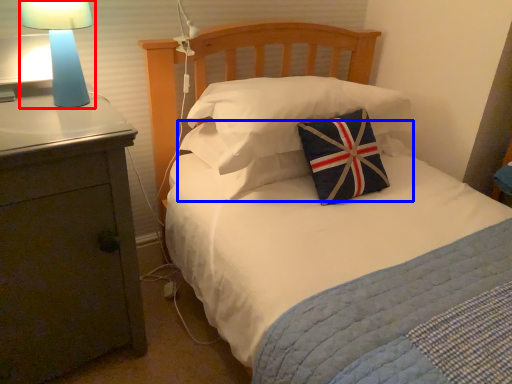
Question: Which object is further to the camera taking this photo, lamp (highlighted by a red box) or pillow (highlighted by a blue box)?

Choices:
 (A) lamp
 (B) pillow

Answer: (B)